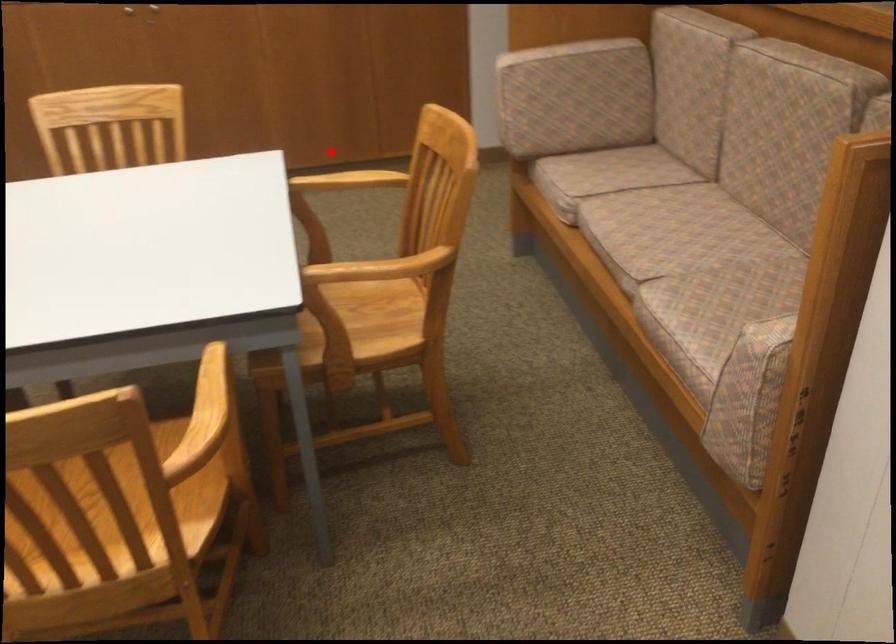
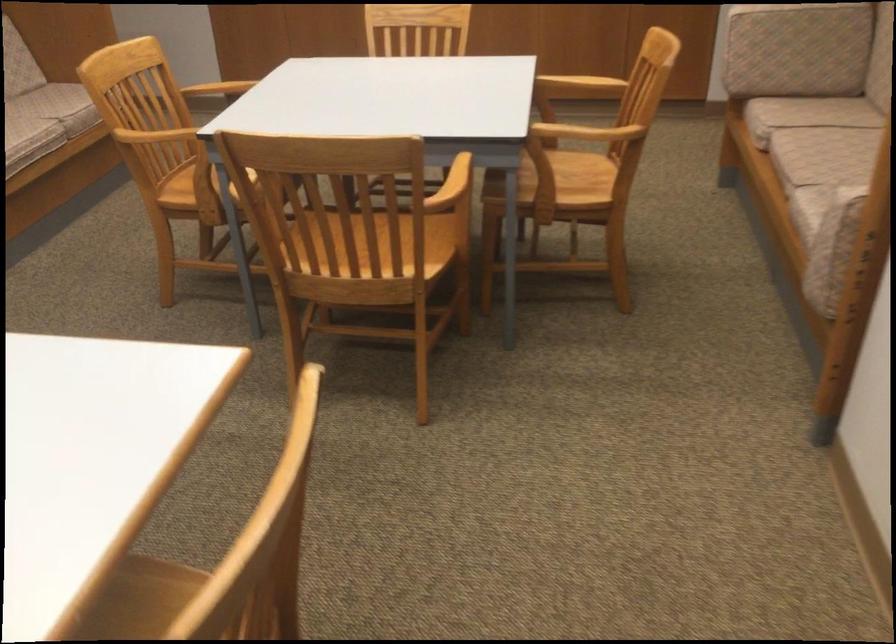
Question: I am providing you with two images of the same scene from different viewpoints. In image1, a red point is highlighted. Considering the same 3D point in image2, which of the following is correct?

Choices:
 (A) It is closer
 (B) It is farther

Answer: (B)